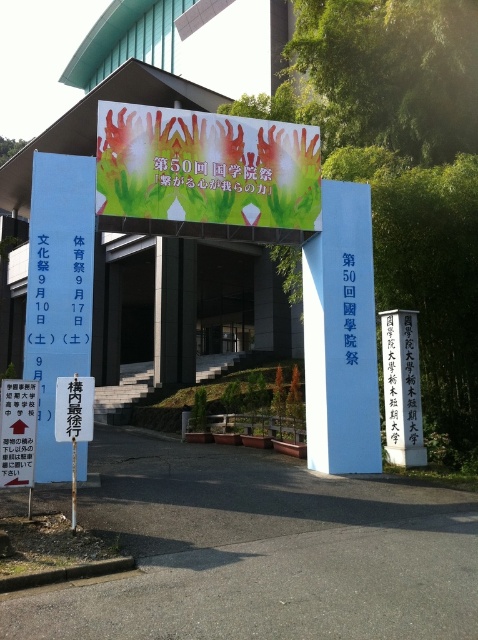
You are standing at the entrance of the university campus and want to find the white stone sign at center. According to the coordinates provided, where should you look?

The white stone sign at center is located at coordinates point (401, 388).